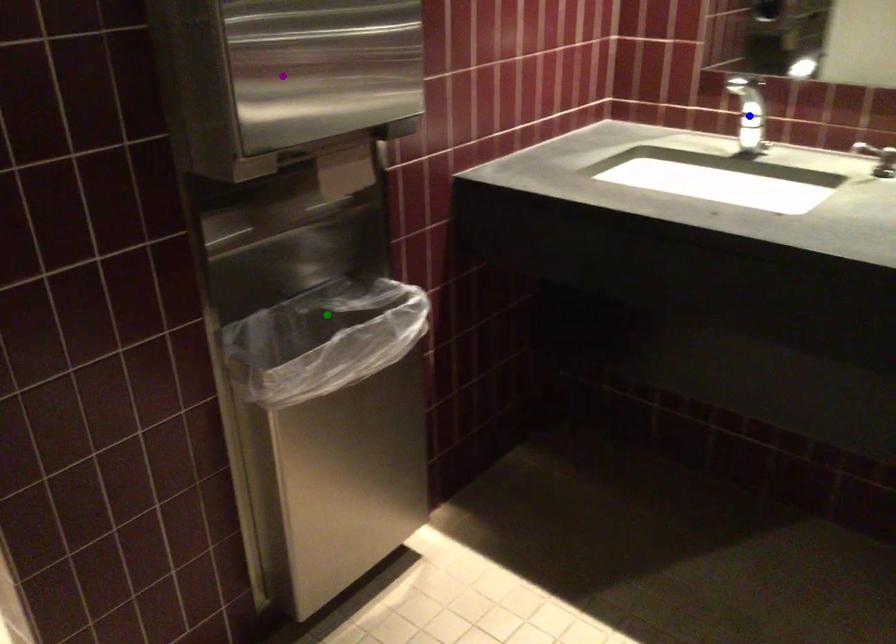
Order these from nearest to farthest:
blue point, green point, purple point

1. purple point
2. green point
3. blue point